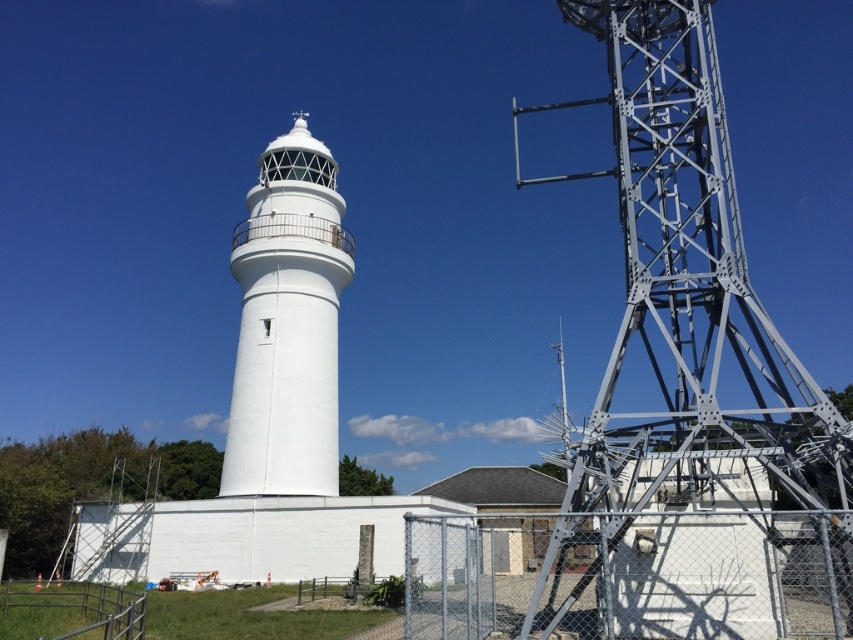
Question: Estimate the real-world distances between objects in this image. Which object is closer to the metallic silver fence at lower left?

Choices:
 (A) white smooth lighthouse at center
 (B) chain-link fence at lower right

Answer: (B)

Question: Is metallic gray tower at right below white smooth lighthouse at center?

Choices:
 (A) no
 (B) yes

Answer: (B)

Question: Based on their relative distances, which object is nearer to the chain-link fence at lower right?

Choices:
 (A) white smooth lighthouse at center
 (B) metallic gray tower at right

Answer: (B)

Question: Does chain-link fence at lower right have a lesser width compared to metallic silver fence at lower left?

Choices:
 (A) yes
 (B) no

Answer: (A)

Question: Is metallic gray tower at right smaller than white smooth lighthouse at center?

Choices:
 (A) yes
 (B) no

Answer: (B)

Question: Which of these objects is positioned closest to the white smooth lighthouse at center?

Choices:
 (A) chain-link fence at lower right
 (B) metallic gray tower at right
 (C) metallic silver fence at lower left

Answer: (C)